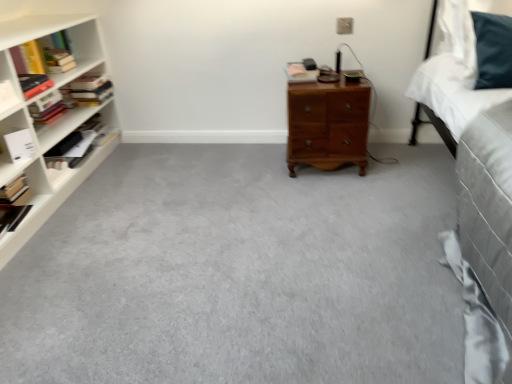
At what (x,y) coordinates should I click in order to perform the action: click on wooden nightstand at center. Please return your answer as a coordinate pair (x, y). Looking at the image, I should click on (328, 124).

Describe the element at coordinates (34, 84) in the screenshot. I see `hardcover books at left, placed as the 4th book when sorted from right to left` at that location.

In order to face hardcover books at left, placed as the 4th book when sorted from right to left, should I rotate leftwards or rightwards?

Turn left by 28.877 degrees to look at hardcover books at left, placed as the 4th book when sorted from right to left.

In order to face hardcover book at left, which ranks as the 3th book in right-to-left order, should I rotate leftwards or rightwards?

You should look left and rotate roughly 23.789 degrees.

This screenshot has width=512, height=384. I want to click on white matte book at left, which appears as the seventh book when viewed from the left, so click(x=20, y=145).

Describe the element at coordinates (20, 145) in the screenshot. This screenshot has height=384, width=512. I see `white matte book at left, which appears as the seventh book when viewed from the left` at that location.

Image resolution: width=512 pixels, height=384 pixels. Find the location of `hardcover book at center, marked as the 1th book in a right-to-left arrangement`. hardcover book at center, marked as the 1th book in a right-to-left arrangement is located at coordinates (300, 73).

Where is `wooden nightstand at center`? The width and height of the screenshot is (512, 384). wooden nightstand at center is located at coordinates (328, 124).

Is white matte book at left, the 2th book in the right-to-left sequence, to the right of hardcover books at left, placed as the 4th book when sorted from right to left, from the viewer's perspective?

Indeed, white matte book at left, the 2th book in the right-to-left sequence, is positioned on the right side of hardcover books at left, placed as the 4th book when sorted from right to left.

Who is taller, white matte book at left, the 2th book in the right-to-left sequence, or hardcover books at left, placed as the 4th book when sorted from right to left?

With more height is white matte book at left, the 2th book in the right-to-left sequence.

From a real-world perspective, who is located lower, white matte book at left, which appears as the seventh book when viewed from the left, or hardcover books at left, placed as the 4th book when sorted from right to left?

From a 3D spatial view, white matte book at left, which appears as the seventh book when viewed from the left, is below.

Which is nearer, (293, 62) or (5, 192)?

Point (293, 62).

Between hardcover book at center, acting as the 8th book starting from the left, and hardcover book at left, the first book in the left-to-right sequence, which one has more height?

With more height is hardcover book at left, the first book in the left-to-right sequence.

Measure the distance between yellow paperback book at left, which is the 3th book in left-to-right order, and hardcover book at left, which is the second book from left to right.

20.75 centimeters.

Looking at this image, how different are the orientations of yellow paperback book at left, which is the 3th book in left-to-right order, and hardcover book at left, which is the second book from left to right, in degrees?

The facing directions of yellow paperback book at left, which is the 3th book in left-to-right order, and hardcover book at left, which is the second book from left to right, are 2.86 degrees apart.

Does yellow paperback book at left, which is the 3th book in left-to-right order, come in front of hardcover book at left, the seventh book from the right?

No, it is behind hardcover book at left, the seventh book from the right.

Who is smaller, yellow paperback book at left, which is the sixth book from right to left, or hardcover book at left, the seventh book from the right?

Smaller between the two is hardcover book at left, the seventh book from the right.

Based on their sizes in the image, would you say white matte book at left, which appears as the seventh book when viewed from the left, is bigger or smaller than wooden nightstand at center?

Considering their sizes, white matte book at left, which appears as the seventh book when viewed from the left, takes up less space than wooden nightstand at center.

From a real-world perspective, is white matte book at left, the 2th book in the right-to-left sequence, physically below wooden nightstand at center?

No.

Is white matte book at left, which appears as the seventh book when viewed from the left, positioned before wooden nightstand at center?

Yes, the depth of white matte book at left, which appears as the seventh book when viewed from the left, is less than that of wooden nightstand at center.

Would you consider white matte book at left, the 2th book in the right-to-left sequence, to be distant from wooden nightstand at center?

Yes, white matte book at left, the 2th book in the right-to-left sequence, is far from wooden nightstand at center.

Does hardcover book at center, acting as the 8th book starting from the left, appear on the left side of yellow paperback book at left, which is the sixth book from right to left?

In fact, hardcover book at center, acting as the 8th book starting from the left, is to the right of yellow paperback book at left, which is the sixth book from right to left.

Considering the positions of objects hardcover book at center, acting as the 8th book starting from the left, and yellow paperback book at left, which is the 3th book in left-to-right order, in the image provided, who is in front, hardcover book at center, acting as the 8th book starting from the left, or yellow paperback book at left, which is the 3th book in left-to-right order,?

hardcover book at center, acting as the 8th book starting from the left.

Is hardcover book at center, acting as the 8th book starting from the left, facing away from yellow paperback book at left, which is the sixth book from right to left?

No.

From a real-world perspective, is hardcover book at center, acting as the 8th book starting from the left, above or below yellow paperback book at left, which is the sixth book from right to left?

hardcover book at center, acting as the 8th book starting from the left, is situated lower than yellow paperback book at left, which is the sixth book from right to left, in the real world.

Who is smaller, hardcover book at left, which ranks as the 8th book in right-to-left order, or hardcover books at left, marked as the 4th book in a left-to-right arrangement?

hardcover book at left, which ranks as the 8th book in right-to-left order, is smaller.

Based on the photo, which of these two, hardcover book at left, the first book in the left-to-right sequence, or hardcover books at left, marked as the 4th book in a left-to-right arrangement, stands shorter?

Standing shorter between the two is hardcover books at left, marked as the 4th book in a left-to-right arrangement.

In the image, is hardcover book at left, which ranks as the 8th book in right-to-left order, positioned in front of or behind hardcover books at left, which appears as the fifth book when viewed from the right?

hardcover book at left, which ranks as the 8th book in right-to-left order, is in front of hardcover books at left, which appears as the fifth book when viewed from the right.

Is point (0, 192) less distant than point (93, 91)?

Yes, it is in front of point (93, 91).

What's the angular difference between hardcover book at left, the first book in the left-to-right sequence, and hardcover book at left, placed as the 6th book when sorted from left to right,'s facing directions?

1.88 degrees.

From the picture: Considering the relative sizes of hardcover book at left, the first book in the left-to-right sequence, and hardcover book at left, placed as the 6th book when sorted from left to right, in the image provided, is hardcover book at left, the first book in the left-to-right sequence, bigger than hardcover book at left, placed as the 6th book when sorted from left to right,?

Actually, hardcover book at left, the first book in the left-to-right sequence, might be smaller than hardcover book at left, placed as the 6th book when sorted from left to right.

Considering the positions of point (25, 185) and point (102, 139), is point (25, 185) closer or farther from the camera than point (102, 139)?

Point (25, 185) appears to be closer to the viewer than point (102, 139).

Looking at this image, considering the sizes of objects hardcover book at left, which ranks as the 8th book in right-to-left order, and hardcover book at left, placed as the 6th book when sorted from left to right, in the image provided, who is taller, hardcover book at left, which ranks as the 8th book in right-to-left order, or hardcover book at left, placed as the 6th book when sorted from left to right,?

hardcover book at left, which ranks as the 8th book in right-to-left order, is taller.

From the image's perspective, count 3rd books upward from the white matte book at left, which appears as the seventh book when viewed from the left, and point to it. Please provide its 2D coordinates.

[(34, 84)]

Where is `book that is the 4th object above the hardcover book at left, which ranks as the 8th book in right-to-left order (from a real-world perspective)`? The image size is (512, 384). book that is the 4th object above the hardcover book at left, which ranks as the 8th book in right-to-left order (from a real-world perspective) is located at coordinates (300, 73).

Which object lies nearer to the anchor point wooden nightstand at center, hardcover book at left, which is the second book from left to right, or white matte book at left, the 2th book in the right-to-left sequence?

white matte book at left, the 2th book in the right-to-left sequence, lies closer to wooden nightstand at center than the other object.

In the scene shown: From the image, which object appears to be nearer to yellow paperback book at left, which is the sixth book from right to left, hardcover book at left, which ranks as the 8th book in right-to-left order, or hardcover books at left, which appears as the fifth book when viewed from the right?

Among the two, hardcover books at left, which appears as the fifth book when viewed from the right, is located nearer to yellow paperback book at left, which is the sixth book from right to left.

When comparing their distances from hardcover book at center, acting as the 8th book starting from the left, does wooden nightstand at center or hardcover book at left, which is the second book from left to right, seem further?

The object further to hardcover book at center, acting as the 8th book starting from the left, is hardcover book at left, which is the second book from left to right.

Estimate the real-world distances between objects in this image. Which object is further from hardcover book at center, acting as the 8th book starting from the left, hardcover book at left, placed as the 6th book when sorted from left to right, or hardcover book at left, the seventh book from the right?

Among the two, hardcover book at left, the seventh book from the right, is located further to hardcover book at center, acting as the 8th book starting from the left.

From the picture: From the image, which object appears to be farther from hardcover books at left, placed as the 5th book when sorted from left to right, hardcover book at left, which is the second book from left to right, or yellow paperback book at left, which is the sixth book from right to left?

hardcover book at left, which is the second book from left to right, is positioned further to the anchor hardcover books at left, placed as the 5th book when sorted from left to right.

Considering their positions, is yellow paperback book at left, which is the 3th book in left-to-right order, positioned further to hardcover books at left, which appears as the fifth book when viewed from the right, than wooden nightstand at center?

wooden nightstand at center.

Based on their spatial positions, is hardcover books at left, placed as the 4th book when sorted from right to left, or hardcover book at left, which is the second book from left to right, further from hardcover book at center, marked as the 1th book in a right-to-left arrangement?

Based on the image, hardcover book at left, which is the second book from left to right, appears to be further to hardcover book at center, marked as the 1th book in a right-to-left arrangement.

Estimate the real-world distances between objects in this image. Which object is closer to wooden nightstand at center, hardcover book at left, which is the second book from left to right, or hardcover books at left, placed as the 4th book when sorted from right to left?

The object closer to wooden nightstand at center is hardcover books at left, placed as the 4th book when sorted from right to left.

Find the location of `book located between white matte book at left, the 2th book in the right-to-left sequence, and wooden nightstand at center in the left-right direction`. book located between white matte book at left, the 2th book in the right-to-left sequence, and wooden nightstand at center in the left-right direction is located at coordinates (300, 73).

Find the location of a particular element. Image resolution: width=512 pixels, height=384 pixels. book between hardcover book at left, placed as the 6th book when sorted from left to right, and hardcover book at center, marked as the 1th book in a right-to-left arrangement, in the horizontal direction is located at coordinates (20, 145).